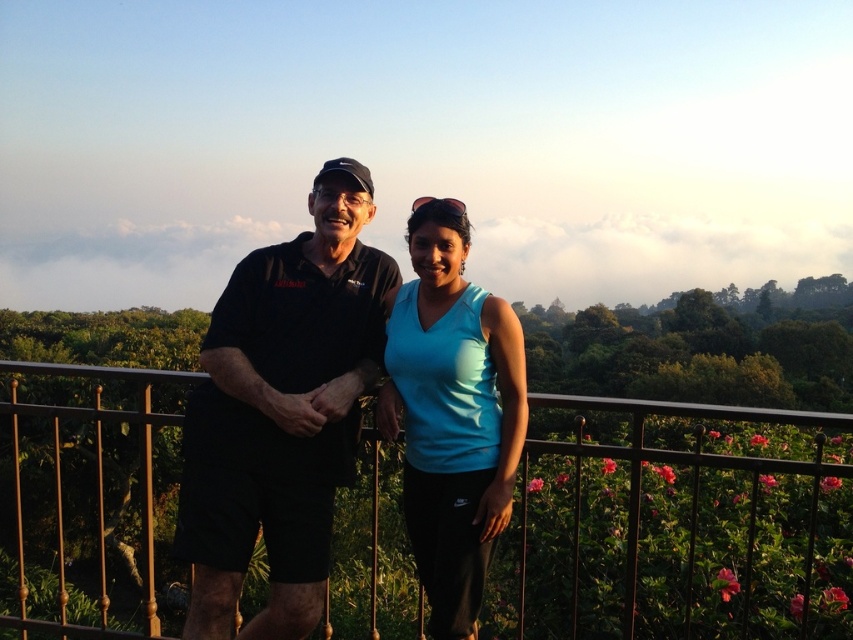
Based on the photo, which is above, black fabric shirt at left or light blue fabric tank top at center?

Positioned higher is black fabric shirt at left.

Is point (190, 500) behind point (428, 316)?

No, (190, 500) is closer to viewer.

Who is more distant from viewer, (248, 314) or (521, 333)?

Positioned behind is point (248, 314).

You are a GUI agent. You are given a task and a screenshot of the screen. Output one action in this format:
    pyautogui.click(x=<x>, y=<y>)
    Task: Click on the black fabric shirt at left
    The width and height of the screenshot is (853, 640).
    Given the screenshot: What is the action you would take?
    pyautogui.click(x=281, y=412)

Which is below, metallic brown railing at center or light blue fabric tank top at center?

metallic brown railing at center is below.

Does point (544, 513) come behind point (488, 438)?

Yes, point (544, 513) is farther from viewer.

Which is in front, point (698, 538) or point (474, 516)?

Point (474, 516) is in front.

The image size is (853, 640). Find the location of `metallic brown railing at center`. metallic brown railing at center is located at coordinates (676, 524).

Who is more forward, [387,612] or [334,262]?

Positioned in front is point [334,262].

The image size is (853, 640). Find the location of `metallic brown railing at center`. metallic brown railing at center is located at coordinates (676, 524).

The height and width of the screenshot is (640, 853). I want to click on metallic brown railing at center, so click(x=676, y=524).